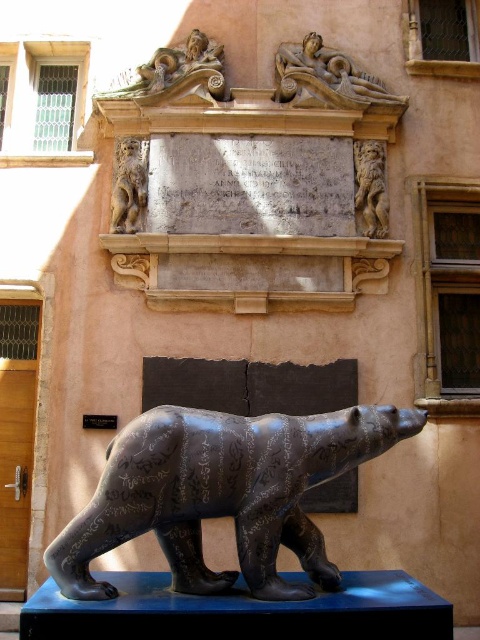
Question: Can you confirm if polished stone relief at upper center is smaller than bronze lion at upper right?

Choices:
 (A) no
 (B) yes

Answer: (A)

Question: Can you confirm if bronze lion at upper right is positioned to the left of black stone plaque at center?

Choices:
 (A) no
 (B) yes

Answer: (A)

Question: Which object is farther from the camera taking this photo?

Choices:
 (A) black stone plaque at center
 (B) polished stone relief at upper center
 (C) stone reclining figure at upper center
 (D) matte stone lion at upper left

Answer: (C)

Question: Estimate the real-world distances between objects in this image. Which object is closer to the bronze bear at center?

Choices:
 (A) matte stone lion at upper left
 (B) bronze lion at upper right
 (C) black stone plaque at center
 (D) stone reclining figure at upper center

Answer: (C)

Question: Does polished stone relief at upper center appear on the left side of black stone plaque at center?

Choices:
 (A) no
 (B) yes

Answer: (A)

Question: Which of the following is the farthest from the observer?

Choices:
 (A) (264, 426)
 (B) (135, 96)
 (C) (385, 182)
 (D) (116, 422)

Answer: (C)